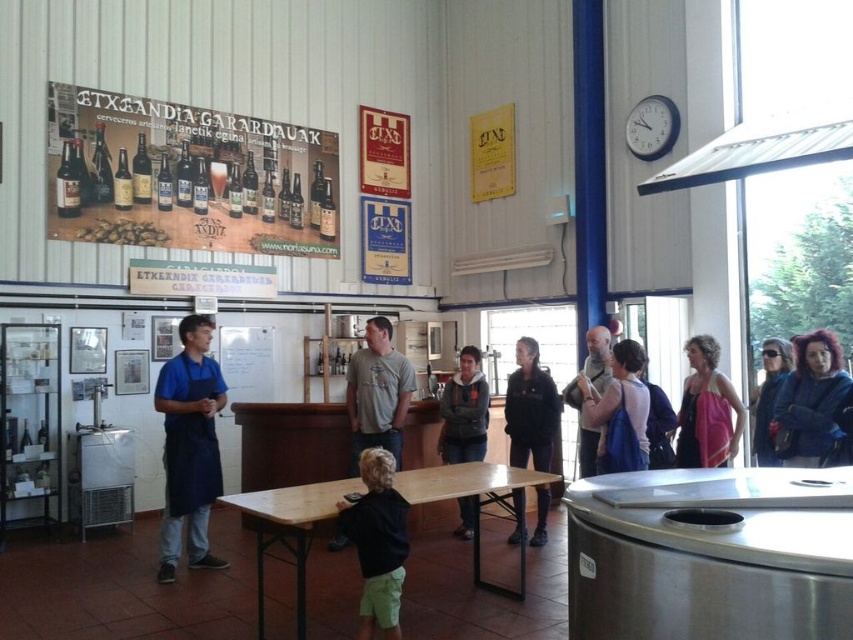
Question: Among these points, which one is farthest from the camera?

Choices:
 (A) [x=434, y=492]
 (B) [x=717, y=392]
 (C) [x=663, y=109]
 (D) [x=651, y=440]

Answer: (C)

Question: Does gray fleece jacket at center lie behind sunglasses leather jacket at right?

Choices:
 (A) yes
 (B) no

Answer: (A)

Question: Based on their relative distances, which object is nearer to the sunglasses leather jacket at right?

Choices:
 (A) matte blue dress at center
 (B) blue fleece jacket at right

Answer: (B)

Question: Which object is positioned closest to the matte blue dress at center?

Choices:
 (A) gray cotton t-shirt at center
 (B) dark blue sweater at center
 (C) white plastic clock at upper right

Answer: (B)

Question: Can you confirm if matte paper poster at upper left is positioned above gray fleece jacket at center?

Choices:
 (A) no
 (B) yes

Answer: (B)

Question: Is matte paper poster at upper left to the left of black matte shirt at lower center from the viewer's perspective?

Choices:
 (A) yes
 (B) no

Answer: (A)